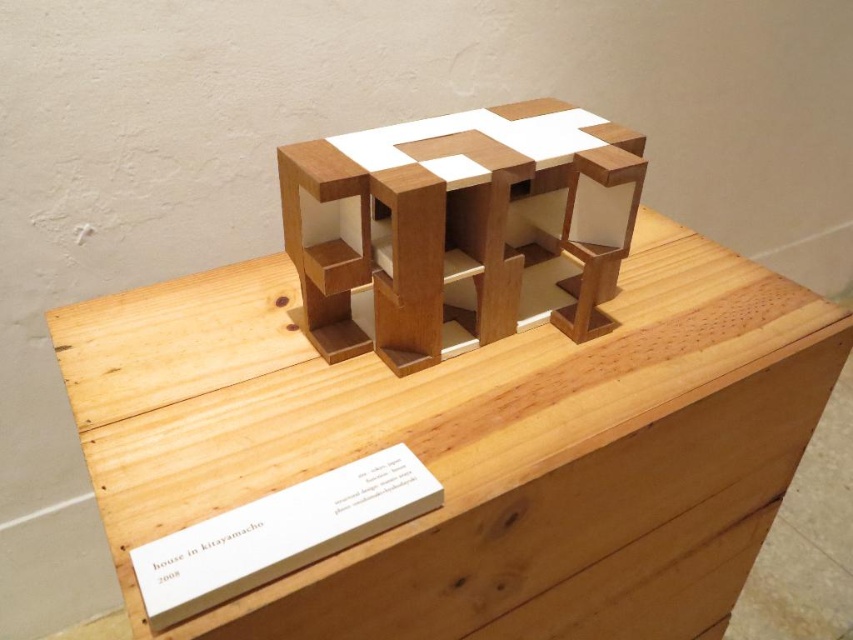
You are an architect examining the architectural model displayed on the stand. You notice the natural wood model at center and the white paper at center. Which object is taller?

The natural wood model at center is taller than the white paper at center.

You are an architect examining the architectural model displayed on a stand. You notice the natural wood model at center and the white paper at center. Which object is positioned higher in the image?

The natural wood model at center is located above the white paper at center, so it is positioned higher in the image.